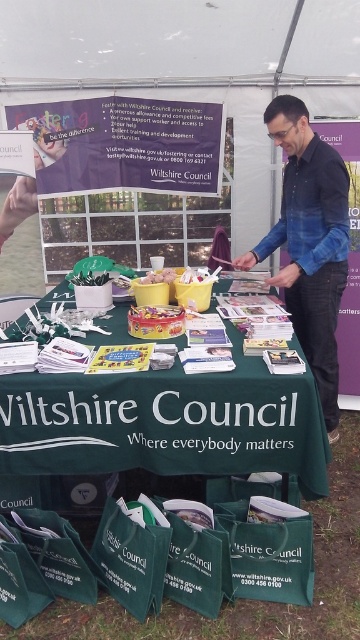
Question: Which of the following is the closest to the observer?

Choices:
 (A) blue denim shirt at center
 (B) green fabric table at center

Answer: (B)

Question: Is green fabric table at center wider than blue denim shirt at center?

Choices:
 (A) yes
 (B) no

Answer: (A)

Question: Is green fabric table at center above blue denim shirt at center?

Choices:
 (A) yes
 (B) no

Answer: (B)

Question: Which point is closer to the camera?

Choices:
 (A) blue denim shirt at center
 (B) green fabric table at center

Answer: (B)

Question: Does green fabric table at center appear on the left side of blue denim shirt at center?

Choices:
 (A) yes
 (B) no

Answer: (A)

Question: Which object appears closest to the camera in this image?

Choices:
 (A) blue denim shirt at center
 (B) green fabric table at center

Answer: (B)